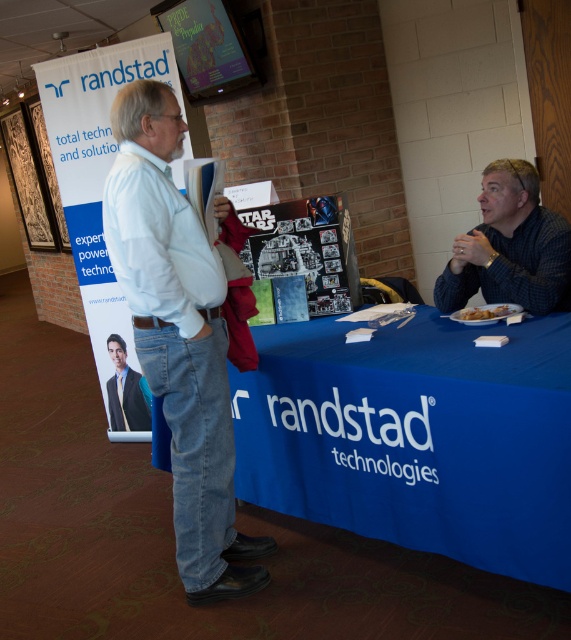
You are a server at a busy restaurant and need to deliver the golden crispy hash browns at lower right to a customer seated at the dark blue suit at center. What is the shortest distance you need to cover to reach them?

The shortest distance you need to cover to reach the customer seated at the dark blue suit at center with the golden crispy hash browns at lower right is 2.31 meters.

You are a food delivery person who needs to place a hot meal on the table. The meal must be placed within 1 meter of the white cotton shirt at center to avoid spills. Can you place the golden crispy hash browns at lower right in the required position?

The white cotton shirt at center and golden crispy hash browns at lower right are 1.09 meters apart, which is slightly more than 1 meter. Therefore, placing the hash browns at lower right would exceed the safe distance, risking spills.